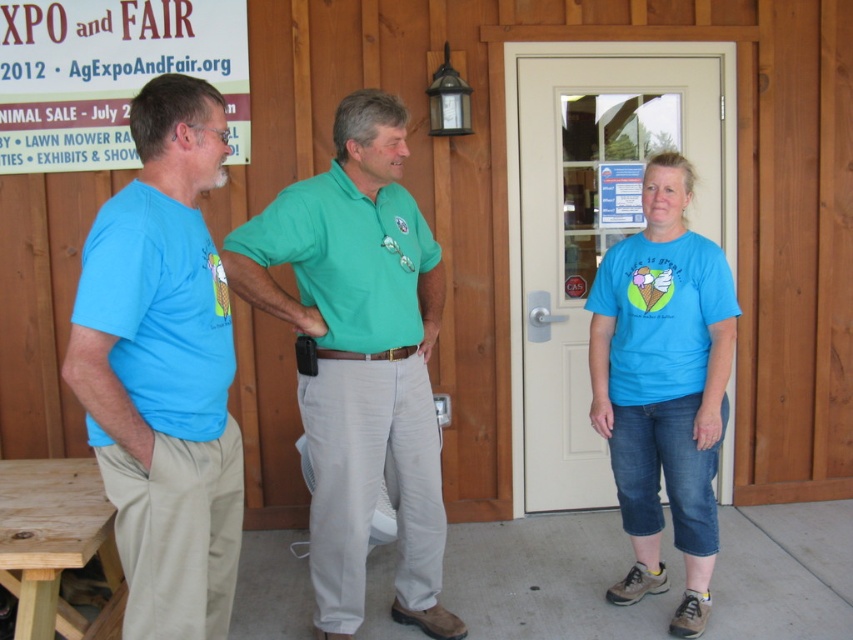
Question: Is matte blue t-shirt at left thinner than wooden picnic table at lower left?

Choices:
 (A) yes
 (B) no

Answer: (A)

Question: Which point is farther to the camera?

Choices:
 (A) (65, 632)
 (B) (434, 480)

Answer: (B)

Question: Can you confirm if matte blue t-shirt at left is wider than green cotton shirt at center?

Choices:
 (A) yes
 (B) no

Answer: (B)

Question: Which point is closer to the camera?

Choices:
 (A) (683, 342)
 (B) (326, 593)
 (C) (155, 365)
 (D) (4, 486)

Answer: (C)

Question: Which object is the farthest from the wooden picnic table at lower left?

Choices:
 (A) green cotton shirt at center
 (B) matte blue t-shirt at left

Answer: (A)

Question: Is matte blue t-shirt at left smaller than wooden picnic table at lower left?

Choices:
 (A) yes
 (B) no

Answer: (A)